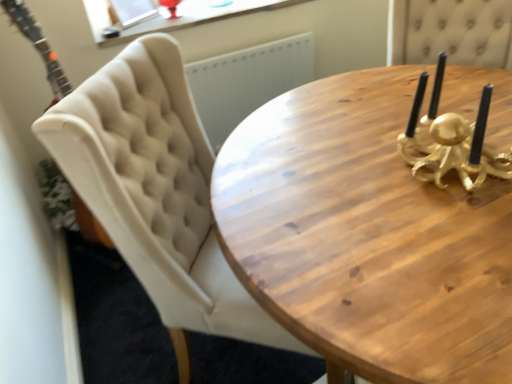
Question: Relative to wooden candle holder at upper right, is beige tufted chair at upper left in front or behind?

Choices:
 (A) front
 (B) behind

Answer: (B)

Question: From the image's perspective, is beige tufted chair at upper left located above or below wooden candle holder at upper right?

Choices:
 (A) above
 (B) below

Answer: (A)

Question: Considering the positions of beige tufted chair at upper left and wooden candle holder at upper right in the image, is beige tufted chair at upper left taller or shorter than wooden candle holder at upper right?

Choices:
 (A) short
 (B) tall

Answer: (B)

Question: Considering their positions, is wooden candle holder at upper right located in front of or behind beige tufted chair at upper left?

Choices:
 (A) behind
 (B) front

Answer: (B)

Question: Considering the positions of point (423, 205) and point (304, 352), is point (423, 205) closer or farther from the camera than point (304, 352)?

Choices:
 (A) closer
 (B) farther

Answer: (A)

Question: Would you say wooden candle holder at upper right is inside or outside beige tufted chair at upper left?

Choices:
 (A) outside
 (B) inside

Answer: (A)

Question: Considering the positions of wooden candle holder at upper right and beige tufted chair at upper left in the image, is wooden candle holder at upper right taller or shorter than beige tufted chair at upper left?

Choices:
 (A) tall
 (B) short

Answer: (B)